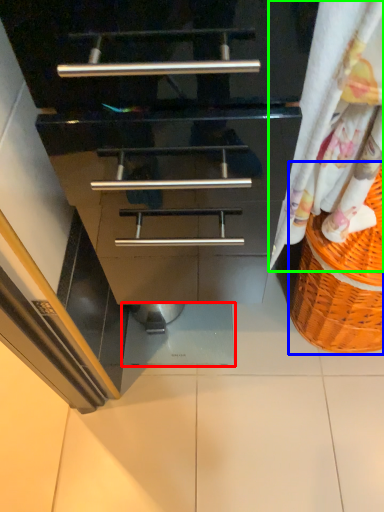
Question: Which object is positioned closest to tile (highlighted by a red box)? Select from basket (highlighted by a blue box) and curtain (highlighted by a green box).

Choices:
 (A) basket
 (B) curtain

Answer: (A)